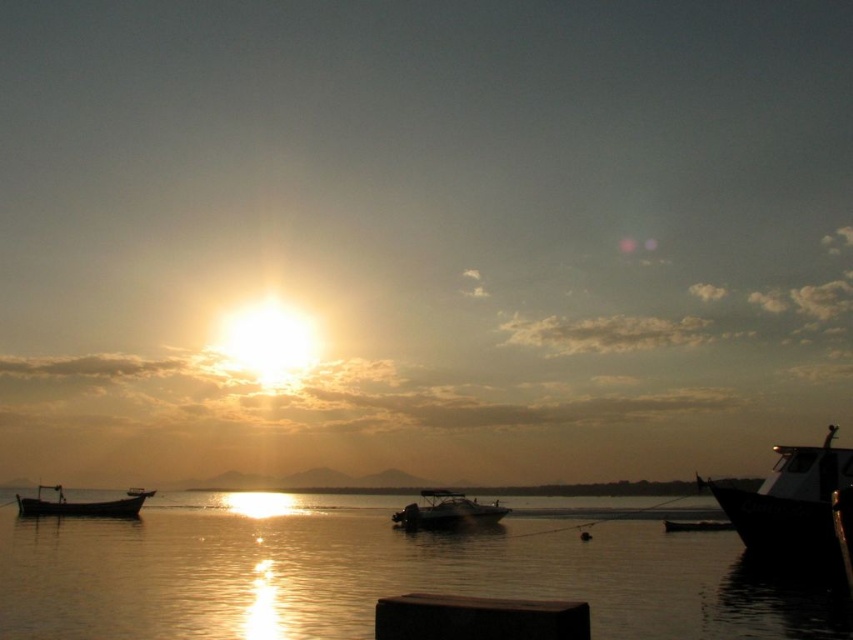
Question: Estimate the real-world distances between objects in this image. Which object is closer to the wooden boat at left?

Choices:
 (A) metallic silver boat at lower right
 (B) dark wood dock at lower center

Answer: (A)

Question: Which object is farther from the camera taking this photo?

Choices:
 (A) dark wood dock at lower center
 (B) wooden boat at left
 (C) metallic silver boat at lower right
 (D) glistening water at center

Answer: (B)

Question: Does wooden boat at left appear under metallic silver boat at lower right?

Choices:
 (A) no
 (B) yes

Answer: (A)

Question: Is glistening water at center positioned behind wooden boat at left?

Choices:
 (A) yes
 (B) no

Answer: (B)

Question: Which object is positioned farthest from the metallic silver boat at lower right?

Choices:
 (A) shiny black boat at right
 (B) dark wood dock at lower center

Answer: (B)

Question: Can you confirm if glossy white boat at center is wider than metallic silver boat at lower right?

Choices:
 (A) no
 (B) yes

Answer: (A)